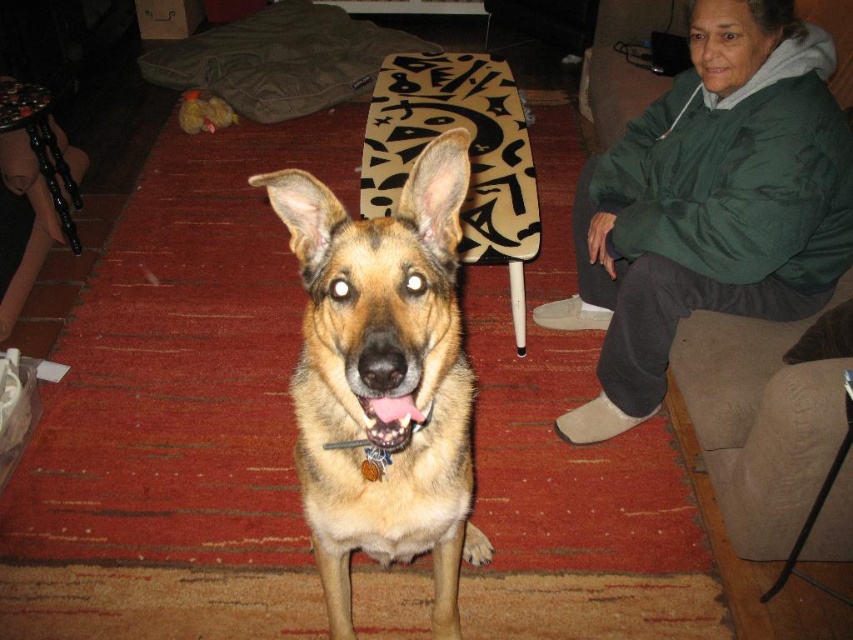
Question: Considering the real-world distances, which object is farthest from the pink glossy teeth at center?

Choices:
 (A) golden fur dog at center
 (B) green fleece jacket at upper right

Answer: (B)

Question: Does green fleece jacket at upper right come in front of pink glossy teeth at center?

Choices:
 (A) no
 (B) yes

Answer: (A)

Question: Among these points, which one is farthest from the camera?

Choices:
 (A) (619, 147)
 (B) (325, 548)

Answer: (A)

Question: Can you confirm if golden fur dog at center is wider than pink glossy teeth at center?

Choices:
 (A) no
 (B) yes

Answer: (B)

Question: Which point appears closest to the camera in this image?

Choices:
 (A) (402, 426)
 (B) (780, 26)
 (C) (477, 563)

Answer: (A)

Question: Is green fleece jacket at upper right smaller than golden fur dog at center?

Choices:
 (A) yes
 (B) no

Answer: (B)